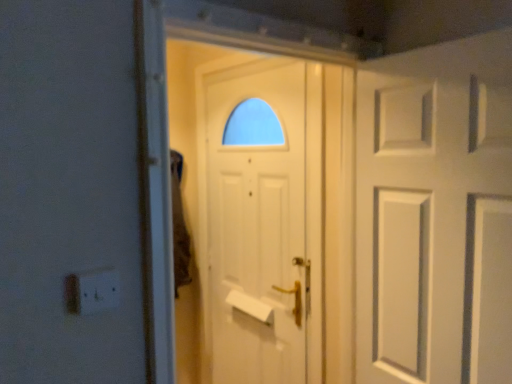
Question: Is white matte door at right, the first door viewed from the front, positioned with its back to white plastic electric outlet at lower left?

Choices:
 (A) no
 (B) yes

Answer: (A)

Question: Can you confirm if white matte door at right, the second door from the back, is positioned to the left of white plastic electric outlet at lower left?

Choices:
 (A) yes
 (B) no

Answer: (B)

Question: From the image's perspective, is white matte door at right, the 1th door positioned from the right, on top of white plastic electric outlet at lower left?

Choices:
 (A) yes
 (B) no

Answer: (A)

Question: Would you say white plastic electric outlet at lower left is part of white matte door at right, the first door viewed from the front,'s contents?

Choices:
 (A) yes
 (B) no

Answer: (B)

Question: From a real-world perspective, is white matte door at right, the first door viewed from the front, physically above white plastic electric outlet at lower left?

Choices:
 (A) no
 (B) yes

Answer: (B)

Question: Considering the positions of white matte door at right, which is the second door in left-to-right order, and white matte door at center, which is counted as the 2th door, starting from the front, in the image, is white matte door at right, which is the second door in left-to-right order, wider or thinner than white matte door at center, which is counted as the 2th door, starting from the front,?

Choices:
 (A) wide
 (B) thin

Answer: (A)

Question: From the image's perspective, is white matte door at right, the 1th door positioned from the right, located above or below white matte door at center, which is the 1th door from left to right?

Choices:
 (A) below
 (B) above

Answer: (B)

Question: From their relative heights in the image, would you say white matte door at right, which is the second door in left-to-right order, is taller or shorter than white matte door at center, which is the 1th door in back-to-front order?

Choices:
 (A) tall
 (B) short

Answer: (B)

Question: In the image, is white matte door at right, which is the second door in left-to-right order, positioned in front of or behind white matte door at center, which is the 1th door in back-to-front order?

Choices:
 (A) behind
 (B) front

Answer: (B)

Question: Based on their positions, is white plastic electric outlet at lower left located to the left or right of white matte door at right, the second door from the back?

Choices:
 (A) left
 (B) right

Answer: (A)

Question: Considering their positions, is white plastic electric outlet at lower left located in front of or behind white matte door at right, the 1th door positioned from the right?

Choices:
 (A) behind
 (B) front

Answer: (B)

Question: From a real-world perspective, is white plastic electric outlet at lower left physically located above or below white matte door at right, the first door viewed from the front?

Choices:
 (A) below
 (B) above

Answer: (A)

Question: In terms of height, does white plastic electric outlet at lower left look taller or shorter compared to white matte door at right, which is the second door in left-to-right order?

Choices:
 (A) tall
 (B) short

Answer: (B)

Question: From a real-world perspective, is white plastic electric outlet at lower left positioned above or below white matte door at center, which is counted as the 2th door, starting from the front?

Choices:
 (A) below
 (B) above

Answer: (B)

Question: Is white plastic electric outlet at lower left wider or thinner than white matte door at center, placed as the second door when sorted from right to left?

Choices:
 (A) wide
 (B) thin

Answer: (B)